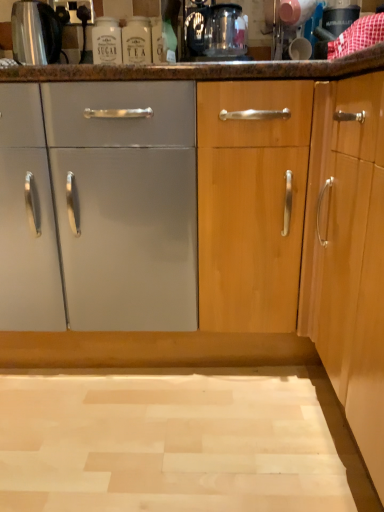
What is the approximate width of brushed metal kettle at upper left?

brushed metal kettle at upper left is 18.73 centimeters wide.

This screenshot has height=512, width=384. In order to click on white glass bottle at upper center in this screenshot , I will do `click(136, 41)`.

Is white glass bottle at upper center taller or shorter than brushed metal kettle at upper left?

Clearly, white glass bottle at upper center is taller compared to brushed metal kettle at upper left.

Is white glass bottle at upper center located outside brushed metal kettle at upper left?

Yes, white glass bottle at upper center is located beyond the bounds of brushed metal kettle at upper left.

Is white glass bottle at upper center in contact with brushed metal kettle at upper left?

No, white glass bottle at upper center is not next to brushed metal kettle at upper left.

Can you confirm if white glass bottle at upper center is positioned to the right of brushed metal kettle at upper left?

Yes.

What's the angular difference between brushed metal kettle at upper left and transparent glass coffee machine at upper center's facing directions?

There is a 0.426-degree angle between the facing directions of brushed metal kettle at upper left and transparent glass coffee machine at upper center.

Considering the relative sizes of brushed metal kettle at upper left and transparent glass coffee machine at upper center in the image provided, is brushed metal kettle at upper left thinner than transparent glass coffee machine at upper center?

Yes, brushed metal kettle at upper left is thinner than transparent glass coffee machine at upper center.

Is brushed metal kettle at upper left bigger or smaller than transparent glass coffee machine at upper center?

In the image, brushed metal kettle at upper left appears to be smaller than transparent glass coffee machine at upper center.

Is brushed metal kettle at upper left at the right side of transparent glass coffee machine at upper center?

In fact, brushed metal kettle at upper left is to the left of transparent glass coffee machine at upper center.

Can brushed metal kettle at upper left be found inside transparent glass coffee machine at upper center?

No, transparent glass coffee machine at upper center does not contain brushed metal kettle at upper left.

Does point (224, 17) come in front of point (47, 60)?

That is True.

Which object is positioned more to the left, transparent glass coffee machine at upper center or brushed metal kettle at upper left?

brushed metal kettle at upper left.

Is brushed metal kettle at upper left at the back of transparent glass coffee machine at upper center?

No.

Would you say brushed metal kettle at upper left is a long distance from white glass bottle at upper center?

No, brushed metal kettle at upper left is not far from white glass bottle at upper center.

From a real-world perspective, is brushed metal kettle at upper left below white glass bottle at upper center?

Actually, brushed metal kettle at upper left is physically above white glass bottle at upper center in the real world.

In the scene shown: Does brushed metal kettle at upper left come in front of white glass bottle at upper center?

Yes, brushed metal kettle at upper left is closer to the viewer.

Considering the sizes of objects brushed metal kettle at upper left and white glass bottle at upper center in the image provided, who is shorter, brushed metal kettle at upper left or white glass bottle at upper center?

With less height is brushed metal kettle at upper left.

Does transparent glass coffee machine at upper center have a greater width compared to white glass bottle at upper center?

Yes.

Does transparent glass coffee machine at upper center have a smaller size compared to white glass bottle at upper center?

No.

Is transparent glass coffee machine at upper center shorter than white glass bottle at upper center?

Correct, transparent glass coffee machine at upper center is not as tall as white glass bottle at upper center.

This screenshot has height=512, width=384. In order to click on bottle beneath the transparent glass coffee machine at upper center (from a real-world perspective) in this screenshot , I will do `click(136, 41)`.

Based on their sizes in the image, would you say white glass bottle at upper center is bigger or smaller than transparent glass coffee machine at upper center?

In the image, white glass bottle at upper center appears to be smaller than transparent glass coffee machine at upper center.

Can you confirm if white glass bottle at upper center is wider than transparent glass coffee machine at upper center?

In fact, white glass bottle at upper center might be narrower than transparent glass coffee machine at upper center.

Between white glass bottle at upper center and transparent glass coffee machine at upper center, which one appears on the left side from the viewer's perspective?

white glass bottle at upper center is more to the left.

From a real-world perspective, is white glass bottle at upper center below transparent glass coffee machine at upper center?

Yes, from a real-world perspective, white glass bottle at upper center is below transparent glass coffee machine at upper center.

Where is `appliance above the white glass bottle at upper center (from a real-world perspective)`? appliance above the white glass bottle at upper center (from a real-world perspective) is located at coordinates (35, 33).

Find the location of a particular element. The height and width of the screenshot is (512, 384). appliance that is behind the transparent glass coffee machine at upper center is located at coordinates (35, 33).

Based on their spatial positions, is brushed metal kettle at upper left or transparent glass coffee machine at upper center further from white glass bottle at upper center?

The object further to white glass bottle at upper center is brushed metal kettle at upper left.

When comparing their distances from white glass bottle at upper center, does transparent glass coffee machine at upper center or brushed metal kettle at upper left seem closer?

Based on the image, transparent glass coffee machine at upper center appears to be nearer to white glass bottle at upper center.

From the image, which object appears to be nearer to transparent glass coffee machine at upper center, white glass bottle at upper center or brushed metal kettle at upper left?

white glass bottle at upper center lies closer to transparent glass coffee machine at upper center than the other object.

Estimate the real-world distances between objects in this image. Which object is closer to brushed metal kettle at upper left, white glass bottle at upper center or transparent glass coffee machine at upper center?

white glass bottle at upper center is closer to brushed metal kettle at upper left.

Looking at the image, which one is located closer to brushed metal kettle at upper left, transparent glass coffee machine at upper center or white glass bottle at upper center?

white glass bottle at upper center is positioned closer to the anchor brushed metal kettle at upper left.

Looking at the image, which one is located closer to transparent glass coffee machine at upper center, brushed metal kettle at upper left or white glass bottle at upper center?

Among the two, white glass bottle at upper center is located nearer to transparent glass coffee machine at upper center.

Find the location of `bottle situated between brushed metal kettle at upper left and transparent glass coffee machine at upper center from left to right`. bottle situated between brushed metal kettle at upper left and transparent glass coffee machine at upper center from left to right is located at coordinates (136, 41).